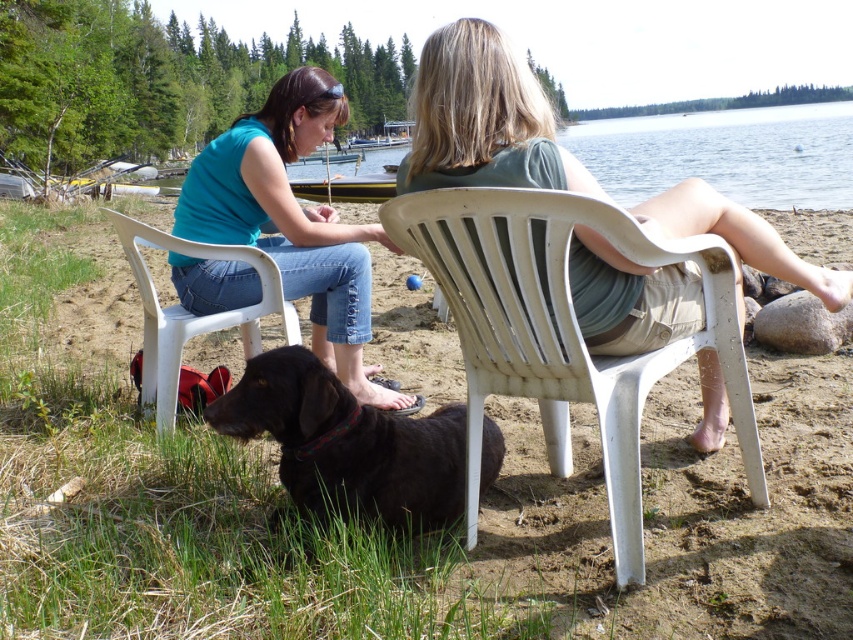
Does brown fur dog at center appear over white plastic chair at lower left?

Actually, brown fur dog at center is below white plastic chair at lower left.

Is brown fur dog at center below white plastic chair at lower left?

Correct, brown fur dog at center is located below white plastic chair at lower left.

Image resolution: width=853 pixels, height=640 pixels. Describe the element at coordinates (369, 529) in the screenshot. I see `brown fur dog at center` at that location.

This screenshot has width=853, height=640. Identify the location of brown fur dog at center. (369, 529).

Does point (3, 349) lie in front of point (421, 224)?

No, (3, 349) is behind (421, 224).

The width and height of the screenshot is (853, 640). Describe the element at coordinates (369, 529) in the screenshot. I see `brown fur dog at center` at that location.

Identify the location of brown fur dog at center. Image resolution: width=853 pixels, height=640 pixels. (369, 529).

Between shiny black dog at lower center and white plastic chair at lower left, which one appears on the left side from the viewer's perspective?

From the viewer's perspective, white plastic chair at lower left appears more on the left side.

This screenshot has width=853, height=640. Identify the location of shiny black dog at lower center. (347, 444).

Between point (434, 484) and point (152, 332), which one is positioned behind?

The point (152, 332) is more distant.

Find the location of a particular element. The height and width of the screenshot is (640, 853). shiny black dog at lower center is located at coordinates (347, 444).